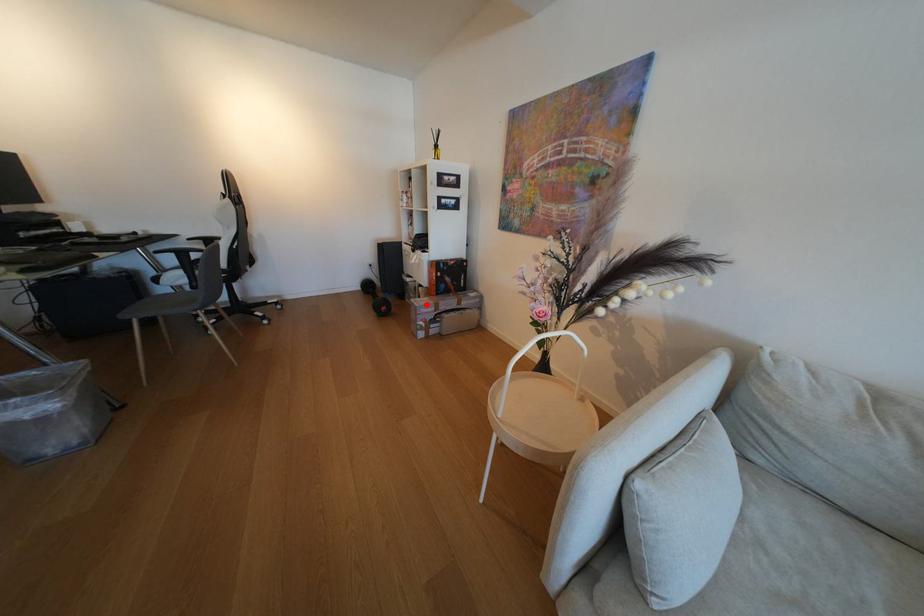
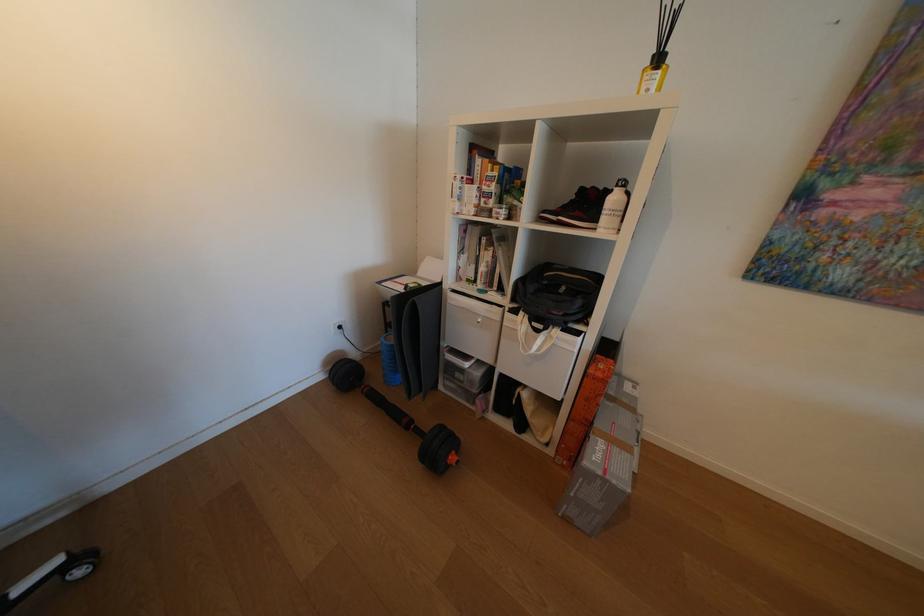
In the second image, find the point that corresponds to the highlighted location in the first image.

(626, 483)